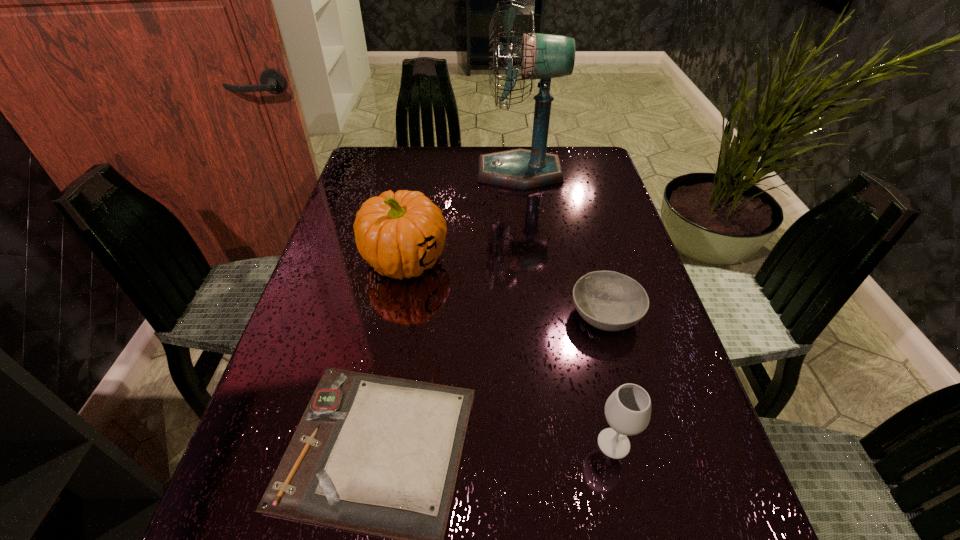
I want to click on blank space at the far right corner of the desktop, so click(x=560, y=154).

Where is `vacant space that's between the second shortest object and the fan`? The width and height of the screenshot is (960, 540). vacant space that's between the second shortest object and the fan is located at coordinates (563, 244).

This screenshot has height=540, width=960. What are the coordinates of `vacant space in between the fan and the bowl` in the screenshot? It's located at (563, 244).

Image resolution: width=960 pixels, height=540 pixels. What are the coordinates of `free spot between the tallest object and the bowl` in the screenshot? It's located at (563, 244).

I want to click on vacant space that's between the farthest object and the pumpkin, so click(462, 217).

The image size is (960, 540). I want to click on free space between the fourth tallest object and the pumpkin, so click(505, 288).

Find the location of `vacant point located between the tallest object and the second tallest object`. vacant point located between the tallest object and the second tallest object is located at coordinates (462, 217).

Identify which object is located as the third nearest to the farthest object. Please provide its 2D coordinates. Your answer should be formatted as a tuple, i.e. [(x, y)], where the tuple contains the x and y coordinates of a point satisfying the conditions above.

[(377, 455)]

At what (x,y) coordinates should I click in order to perform the action: click on object that is the third closest to the second tallest object. Please return your answer as a coordinate pair (x, y). The width and height of the screenshot is (960, 540). Looking at the image, I should click on (611, 301).

Where is `free point that satisfies the following two spatial constraints: 1. on the surface of the fourth shortest object; 2. on the right side of the bowl`? This screenshot has width=960, height=540. free point that satisfies the following two spatial constraints: 1. on the surface of the fourth shortest object; 2. on the right side of the bowl is located at coordinates (396, 315).